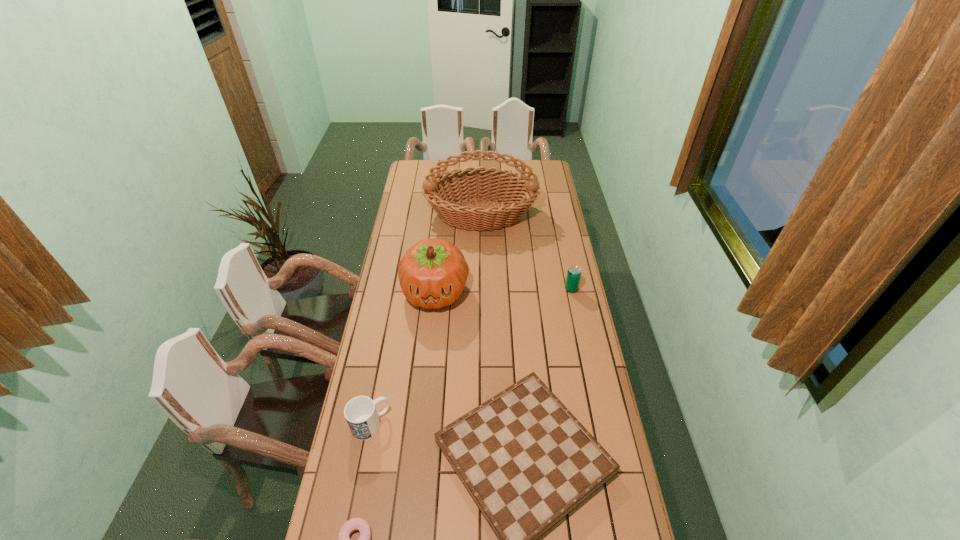
Locate an element on the screen. The width and height of the screenshot is (960, 540). basket is located at coordinates (443, 192).

This screenshot has height=540, width=960. What are the coordinates of `the farthest object` in the screenshot? It's located at (443, 192).

The width and height of the screenshot is (960, 540). Identify the location of pumpkin. (432, 274).

At what (x,y) coordinates should I click in order to perform the action: click on beer can. Please return your answer as a coordinate pair (x, y). Looking at the image, I should click on (574, 273).

This screenshot has width=960, height=540. Identify the location of mug. (360, 412).

Identify the location of vacant space located 0.130m on the front of the farthest object. (481, 258).

This screenshot has height=540, width=960. Find the location of `free region located on the side of the pumpkin with the cute face`. free region located on the side of the pumpkin with the cute face is located at coordinates (430, 343).

Where is `free space located on the front of the beer can`? The height and width of the screenshot is (540, 960). free space located on the front of the beer can is located at coordinates (575, 309).

You are a GUI agent. You are given a task and a screenshot of the screen. Output one action in this format:
    pyautogui.click(x=<x>, y=<y>)
    Task: Click on the vacant point located 0.320m on the right of the mug
    
    Given the screenshot: What is the action you would take?
    pos(485,424)

In order to click on basket present at the left edge in this screenshot , I will do `click(443, 192)`.